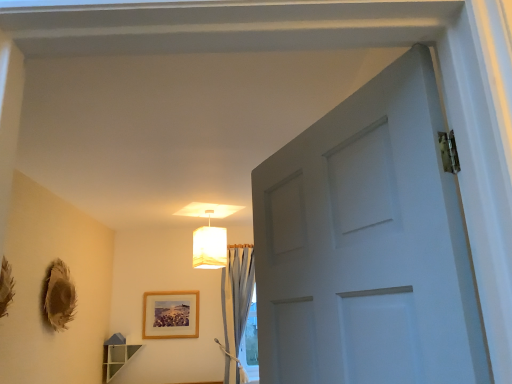
Question: Does light blue sheer curtain at center have a lesser height compared to wooden frame at center?

Choices:
 (A) no
 (B) yes

Answer: (A)

Question: Considering the relative sizes of light blue sheer curtain at center and wooden frame at center in the image provided, is light blue sheer curtain at center bigger than wooden frame at center?

Choices:
 (A) no
 (B) yes

Answer: (B)

Question: Is light blue sheer curtain at center located outside wooden frame at center?

Choices:
 (A) no
 (B) yes

Answer: (B)

Question: Considering the relative sizes of light blue sheer curtain at center and wooden frame at center in the image provided, is light blue sheer curtain at center smaller than wooden frame at center?

Choices:
 (A) yes
 (B) no

Answer: (B)

Question: Does light blue sheer curtain at center turn towards wooden frame at center?

Choices:
 (A) no
 (B) yes

Answer: (A)

Question: Is wooden frame at center inside or outside of light blue sheer curtain at center?

Choices:
 (A) inside
 (B) outside

Answer: (B)

Question: Looking at the image, does wooden frame at center seem bigger or smaller compared to light blue sheer curtain at center?

Choices:
 (A) big
 (B) small

Answer: (B)

Question: Based on their positions, is wooden frame at center located to the left or right of light blue sheer curtain at center?

Choices:
 (A) right
 (B) left

Answer: (B)

Question: Is point (179, 301) positioned closer to the camera than point (238, 273)?

Choices:
 (A) farther
 (B) closer

Answer: (A)

Question: From the image's perspective, relative to wooden frame at center, is light blue sheer curtain at center above or below?

Choices:
 (A) above
 (B) below

Answer: (A)

Question: Choose the correct answer: Is light blue sheer curtain at center inside wooden frame at center or outside it?

Choices:
 (A) inside
 (B) outside

Answer: (B)

Question: In terms of size, does light blue sheer curtain at center appear bigger or smaller than wooden frame at center?

Choices:
 (A) big
 (B) small

Answer: (A)

Question: From a real-world perspective, is light blue sheer curtain at center above or below wooden frame at center?

Choices:
 (A) above
 (B) below

Answer: (B)

Question: From their relative heights in the image, would you say light blue sheer curtain at center is taller or shorter than white fabric lampshade at upper center?

Choices:
 (A) short
 (B) tall

Answer: (B)

Question: Is point (242, 276) positioned closer to the camera than point (194, 266)?

Choices:
 (A) closer
 (B) farther

Answer: (A)